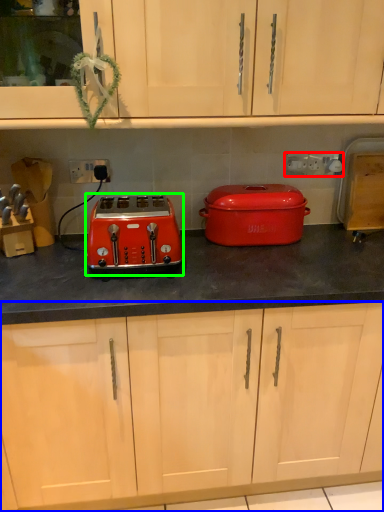
Question: Which is farther away from electric outlet (highlighted by a red box)? cabinetry (highlighted by a blue box) or toaster (highlighted by a green box)?

Choices:
 (A) cabinetry
 (B) toaster

Answer: (A)